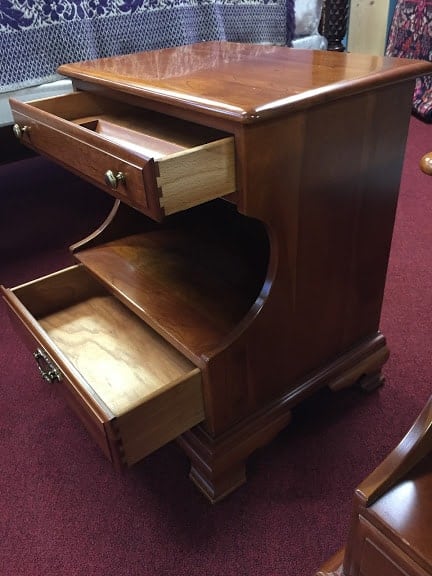
Locate an element on the screen. light source reflection is located at coordinates (398, 496).